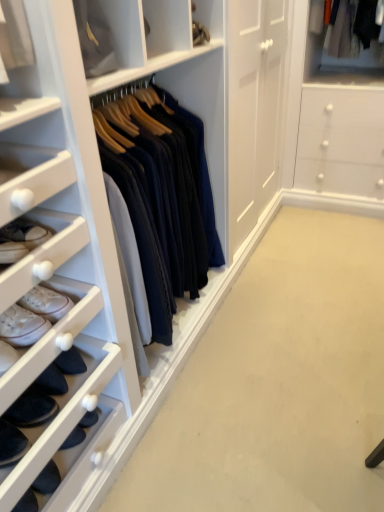
What do you see at coordinates (33, 316) in the screenshot?
I see `white leather sneakers at lower left, arranged as the second footwear when ordered from the bottom` at bounding box center [33, 316].

Measure the distance between matte white cabinet at upper center and camera.

4.30 feet.

This screenshot has width=384, height=512. Identify the location of dark blue suede shoe at lower left, which is counted as the 2th footwear, starting from the top. click(11, 444).

From the picture: Would you say white leather sneakers at lower left, arranged as the second footwear when ordered from the bottom, is outside dark blue suede shoe at lower left, placed as the 1th footwear when sorted from bottom to top?

Absolutely, white leather sneakers at lower left, arranged as the second footwear when ordered from the bottom, is external to dark blue suede shoe at lower left, placed as the 1th footwear when sorted from bottom to top.

Considering the relative sizes of white leather sneakers at lower left, arranged as the second footwear when ordered from the bottom, and dark blue suede shoe at lower left, placed as the 1th footwear when sorted from bottom to top, in the image provided, is white leather sneakers at lower left, arranged as the second footwear when ordered from the bottom, thinner than dark blue suede shoe at lower left, placed as the 1th footwear when sorted from bottom to top,?

Correct, the width of white leather sneakers at lower left, arranged as the second footwear when ordered from the bottom, is less than that of dark blue suede shoe at lower left, placed as the 1th footwear when sorted from bottom to top.

From the image's perspective, would you say white leather sneakers at lower left, arranged as the 1th footwear when viewed from the top, is positioned over dark blue suede shoe at lower left, which is counted as the 2th footwear, starting from the top?

Yes, from the image's perspective, white leather sneakers at lower left, arranged as the 1th footwear when viewed from the top, is on top of dark blue suede shoe at lower left, which is counted as the 2th footwear, starting from the top.

Could you tell me if white leather sneakers at lower left, arranged as the second footwear when ordered from the bottom, is turned towards dark blue suede shoe at lower left, placed as the 1th footwear when sorted from bottom to top?

No, white leather sneakers at lower left, arranged as the second footwear when ordered from the bottom, is not aimed at dark blue suede shoe at lower left, placed as the 1th footwear when sorted from bottom to top.

Does dark blue suede shoe at lower left, which is counted as the 2th footwear, starting from the top, have a smaller size compared to white leather sneakers at lower left, arranged as the second footwear when ordered from the bottom?

Actually, dark blue suede shoe at lower left, which is counted as the 2th footwear, starting from the top, might be larger than white leather sneakers at lower left, arranged as the second footwear when ordered from the bottom.

Is dark blue suede shoe at lower left, placed as the 1th footwear when sorted from bottom to top, touching white leather sneakers at lower left, arranged as the 1th footwear when viewed from the top?

dark blue suede shoe at lower left, placed as the 1th footwear when sorted from bottom to top, and white leather sneakers at lower left, arranged as the 1th footwear when viewed from the top, are clearly separated.

Which is more to the left, dark blue suede shoe at lower left, which is counted as the 2th footwear, starting from the top, or white leather sneakers at lower left, arranged as the 1th footwear when viewed from the top?

dark blue suede shoe at lower left, which is counted as the 2th footwear, starting from the top.

Is dark blue suede shoe at lower left, placed as the 1th footwear when sorted from bottom to top, turned away from matte white cabinet at upper center?

That's not correct — dark blue suede shoe at lower left, placed as the 1th footwear when sorted from bottom to top, is not looking away from matte white cabinet at upper center.

Based on the photo, can you tell me how much dark blue suede shoe at lower left, placed as the 1th footwear when sorted from bottom to top, and matte white cabinet at upper center differ in facing direction?

The angular difference between dark blue suede shoe at lower left, placed as the 1th footwear when sorted from bottom to top, and matte white cabinet at upper center is 3.33 degrees.

Considering the relative sizes of dark blue suede shoe at lower left, placed as the 1th footwear when sorted from bottom to top, and matte white cabinet at upper center in the image provided, is dark blue suede shoe at lower left, placed as the 1th footwear when sorted from bottom to top, wider than matte white cabinet at upper center?

Yes, dark blue suede shoe at lower left, placed as the 1th footwear when sorted from bottom to top, is wider than matte white cabinet at upper center.

Does point (4, 424) come in front of point (155, 36)?

Yes.

Can you see matte white cabinet at upper center touching white leather sneakers at lower left, arranged as the 1th footwear when viewed from the top?

No, matte white cabinet at upper center is not beside white leather sneakers at lower left, arranged as the 1th footwear when viewed from the top.

Between matte white cabinet at upper center and white leather sneakers at lower left, arranged as the second footwear when ordered from the bottom, which one has smaller size?

white leather sneakers at lower left, arranged as the second footwear when ordered from the bottom, is smaller.

From their relative heights in the image, would you say matte white cabinet at upper center is taller or shorter than white leather sneakers at lower left, arranged as the 1th footwear when viewed from the top?

Considering their sizes, matte white cabinet at upper center has more height than white leather sneakers at lower left, arranged as the 1th footwear when viewed from the top.

From a real-world perspective, is matte white cabinet at upper center over white leather sneakers at lower left, arranged as the 1th footwear when viewed from the top?

Yes, from a real-world perspective, matte white cabinet at upper center is on top of white leather sneakers at lower left, arranged as the 1th footwear when viewed from the top.

Between matte white cabinet at upper center and dark blue suede shoe at lower left, which is counted as the 2th footwear, starting from the top, which one is positioned in front?

dark blue suede shoe at lower left, which is counted as the 2th footwear, starting from the top, is in front.

From the image's perspective, which is below, matte white cabinet at upper center or dark blue suede shoe at lower left, which is counted as the 2th footwear, starting from the top?

dark blue suede shoe at lower left, which is counted as the 2th footwear, starting from the top, from the image's perspective.

Does point (209, 23) appear closer or farther from the camera than point (3, 450)?

Point (209, 23).

Between white leather sneakers at lower left, arranged as the 1th footwear when viewed from the top, and matte white cabinet at upper center, which one has less height?

white leather sneakers at lower left, arranged as the 1th footwear when viewed from the top, is shorter.

Would you say white leather sneakers at lower left, arranged as the 1th footwear when viewed from the top, contains matte white cabinet at upper center?

No, matte white cabinet at upper center is not inside white leather sneakers at lower left, arranged as the 1th footwear when viewed from the top.

Is white leather sneakers at lower left, arranged as the second footwear when ordered from the bottom, looking in the opposite direction of matte white cabinet at upper center?

white leather sneakers at lower left, arranged as the second footwear when ordered from the bottom, does not have its back to matte white cabinet at upper center.

Measure the distance between white leather sneakers at lower left, arranged as the 1th footwear when viewed from the top, and matte white cabinet at upper center.

The distance of white leather sneakers at lower left, arranged as the 1th footwear when viewed from the top, from matte white cabinet at upper center is 37.63 inches.

You are a GUI agent. You are given a task and a screenshot of the screen. Output one action in this format:
    pyautogui.click(x=<x>, y=<y>)
    Task: Click on the footwear above the dark blue suede shoe at lower left, placed as the 1th footwear when sorted from bottom to top (from the image's perspective)
    
    Given the screenshot: What is the action you would take?
    pyautogui.click(x=33, y=316)

The width and height of the screenshot is (384, 512). In order to click on footwear located on the right of dark blue suede shoe at lower left, which is counted as the 2th footwear, starting from the top in this screenshot , I will do `click(33, 316)`.

From the image, which object appears to be nearer to matte white cabinet at upper center, dark blue suede shoe at lower left, which is counted as the 2th footwear, starting from the top, or white leather sneakers at lower left, arranged as the 1th footwear when viewed from the top?

The object closer to matte white cabinet at upper center is white leather sneakers at lower left, arranged as the 1th footwear when viewed from the top.

When comparing their distances from dark blue suede shoe at lower left, which is counted as the 2th footwear, starting from the top, does white leather sneakers at lower left, arranged as the 1th footwear when viewed from the top, or matte white cabinet at upper center seem closer?

Among the two, white leather sneakers at lower left, arranged as the 1th footwear when viewed from the top, is located nearer to dark blue suede shoe at lower left, which is counted as the 2th footwear, starting from the top.

Which object lies further to the anchor point white leather sneakers at lower left, arranged as the 1th footwear when viewed from the top, matte white cabinet at upper center or dark blue suede shoe at lower left, placed as the 1th footwear when sorted from bottom to top?

matte white cabinet at upper center.

When comparing their distances from matte white cabinet at upper center, does white leather sneakers at lower left, arranged as the 1th footwear when viewed from the top, or dark blue suede shoe at lower left, which is counted as the 2th footwear, starting from the top, seem further?

dark blue suede shoe at lower left, which is counted as the 2th footwear, starting from the top, lies further to matte white cabinet at upper center than the other object.

Estimate the real-world distances between objects in this image. Which object is closer to dark blue suede shoe at lower left, which is counted as the 2th footwear, starting from the top, matte white cabinet at upper center or white leather sneakers at lower left, arranged as the second footwear when ordered from the bottom?

white leather sneakers at lower left, arranged as the second footwear when ordered from the bottom.

When comparing their distances from white leather sneakers at lower left, arranged as the second footwear when ordered from the bottom, does dark blue suede shoe at lower left, which is counted as the 2th footwear, starting from the top, or matte white cabinet at upper center seem closer?

Among the two, dark blue suede shoe at lower left, which is counted as the 2th footwear, starting from the top, is located nearer to white leather sneakers at lower left, arranged as the second footwear when ordered from the bottom.

Locate an element on the screen. The height and width of the screenshot is (512, 384). footwear between matte white cabinet at upper center and dark blue suede shoe at lower left, placed as the 1th footwear when sorted from bottom to top, in the up-down direction is located at coordinates (33, 316).